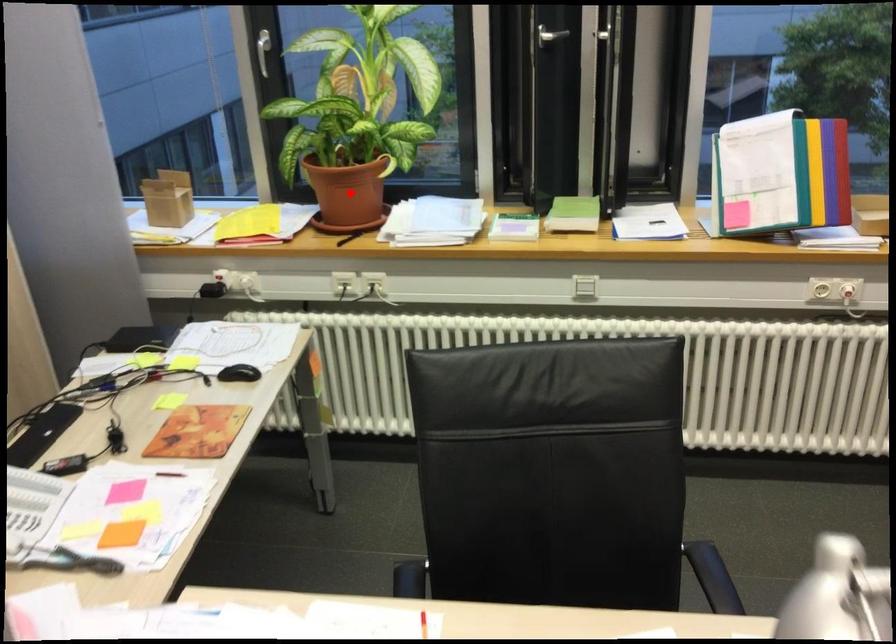
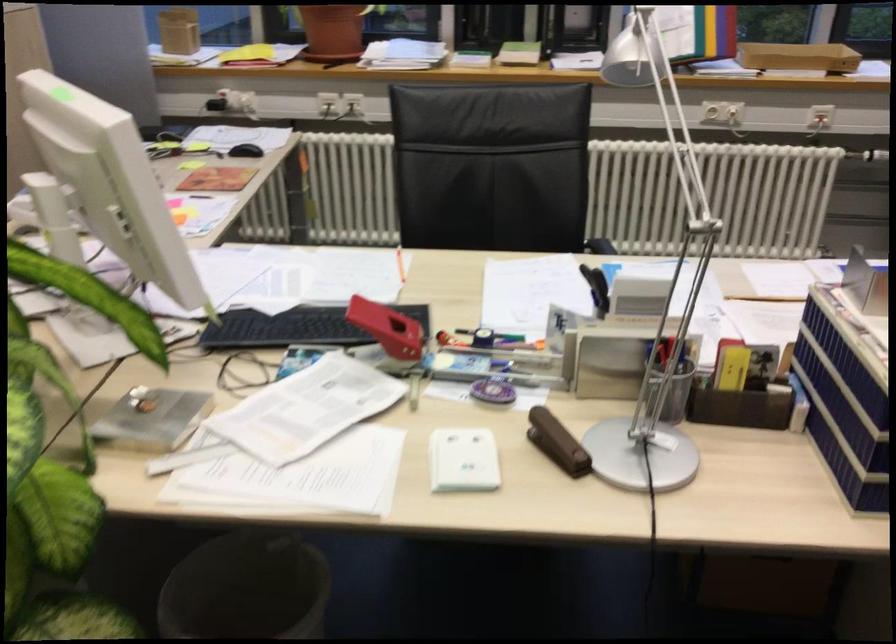
Question: I am providing you with two images of the same scene from different viewpoints. A red point is shown in image1. For the corresponding object point in image2, is it positioned nearer or farther from the camera?

Choices:
 (A) Nearer
 (B) Farther

Answer: (B)